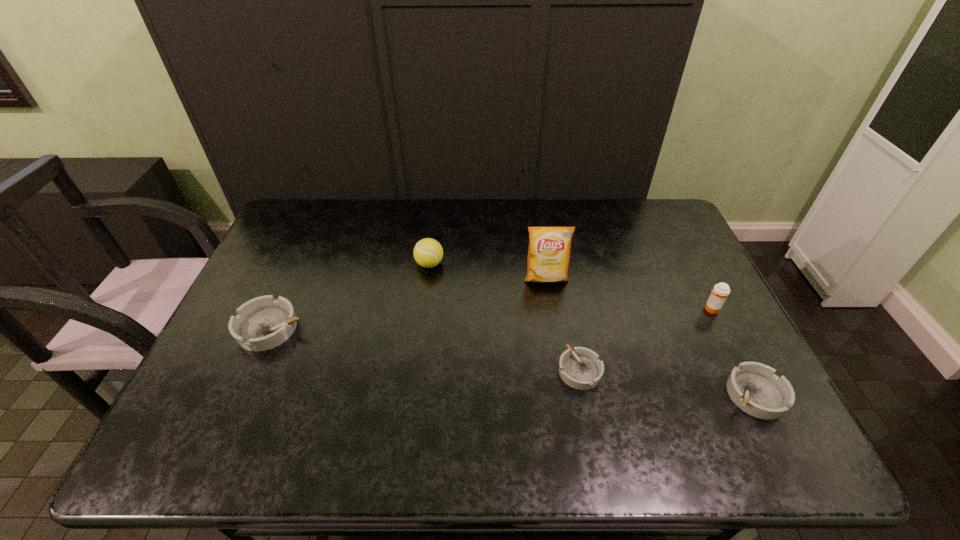
This screenshot has width=960, height=540. I want to click on the fourth tallest object, so (263, 323).

This screenshot has width=960, height=540. Find the location of `the tallest ashtray`. the tallest ashtray is located at coordinates (263, 323).

You are a GUI agent. You are given a task and a screenshot of the screen. Output one action in this format:
    pyautogui.click(x=<x>, y=<y>)
    Task: Click on the second ashtray from left to right
    The width and height of the screenshot is (960, 540).
    Given the screenshot: What is the action you would take?
    pyautogui.click(x=580, y=368)

Where is `the shortest ashtray`? the shortest ashtray is located at coordinates (580, 368).

The image size is (960, 540). What are the coordinates of `the second shortest object` in the screenshot? It's located at point(752,386).

You are a GUI agent. You are given a task and a screenshot of the screen. Output one action in this format:
    pyautogui.click(x=<x>, y=<y>)
    Task: Click on the rightmost ashtray
    Image resolution: width=960 pixels, height=540 pixels.
    Given the screenshot: What is the action you would take?
    pyautogui.click(x=752, y=386)

Image resolution: width=960 pixels, height=540 pixels. I want to click on the tallest object, so click(x=548, y=258).

Where is `the second object from left to right`? the second object from left to right is located at coordinates (428, 252).

Locate an element on the screen. The image size is (960, 540). medicine is located at coordinates (721, 290).

The width and height of the screenshot is (960, 540). What are the coordinates of `vacant space located 0.070m on the front of the tallest ashtray` in the screenshot? It's located at (250, 376).